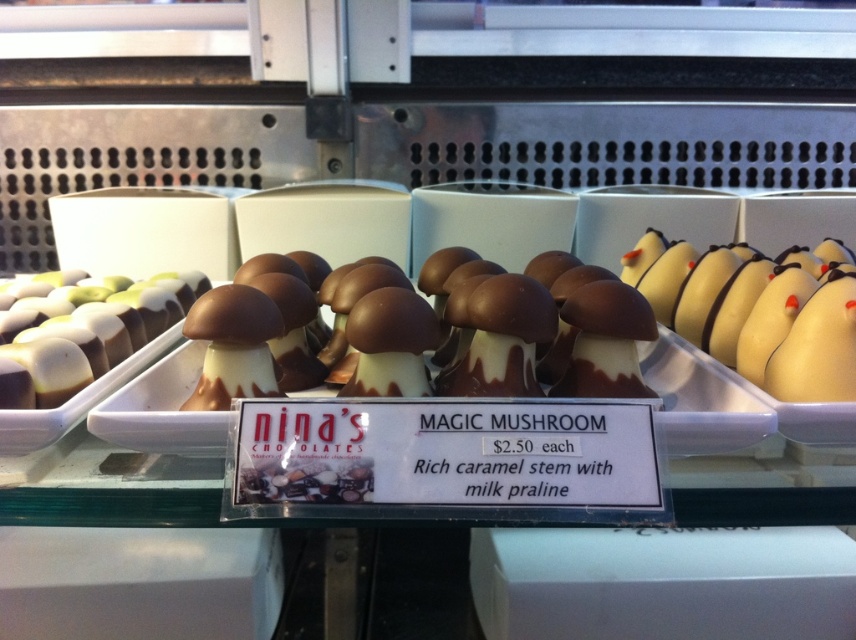
Question: Estimate the real-world distances between objects in this image. Which object is closer to the white chocolate with red accents at center?

Choices:
 (A) white glossy chocolate at left
 (B) chocolate-coated mushroom at center

Answer: (B)

Question: Observing the image, what is the correct spatial positioning of chocolate-coated mushroom at center in reference to white glossy chocolate at left?

Choices:
 (A) below
 (B) above

Answer: (A)

Question: Which point is closer to the camera taking this photo?

Choices:
 (A) (789, 333)
 (B) (110, 355)
 (C) (509, 356)

Answer: (C)

Question: Which point is farther to the camera?

Choices:
 (A) pos(169,273)
 (B) pos(373,317)
 (C) pos(818,285)

Answer: (A)

Question: Is chocolate-coated mushroom at center to the left of white glossy chocolate at left from the viewer's perspective?

Choices:
 (A) no
 (B) yes

Answer: (A)

Question: Can you confirm if chocolate-coated mushroom at center is wider than white glossy chocolate at left?

Choices:
 (A) no
 (B) yes

Answer: (B)